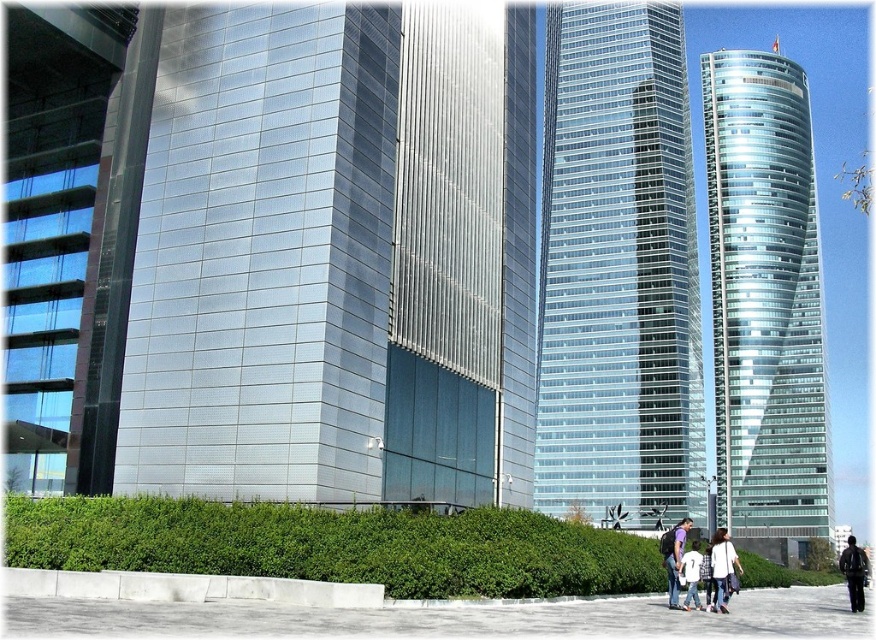
Is green leafy hedge at lower center positioned behind white matte shirt at center?

No, it is not.

Is green leafy hedge at lower center below white matte shirt at center?

No, green leafy hedge at lower center is not below white matte shirt at center.

Measure the distance between green leafy hedge at lower center and camera.

68.81 feet

Identify the location of green leafy hedge at lower center. The image size is (876, 640). (333, 545).

At what (x,y) coordinates should I click in order to perform the action: click on dark blue jeans at lower right. Please return your answer as a coordinate pair (x, y). Looking at the image, I should click on (853, 572).

Looking at this image, who is taller, dark blue jeans at lower right or white cotton shirt at center?

dark blue jeans at lower right is taller.

Locate an element on the screen. dark blue jeans at lower right is located at coordinates (853, 572).

Which of these two, gray concrete pavement at lower center or white cotton shirt at center, stands taller?

With more height is gray concrete pavement at lower center.

Does point (55, 627) lie in front of point (683, 573)?

Yes, point (55, 627) is closer to viewer.

Looking at this image, who is more forward, (468,625) or (697,592)?

Point (468,625)

This screenshot has width=876, height=640. Identify the location of gray concrete pavement at lower center. (444, 618).